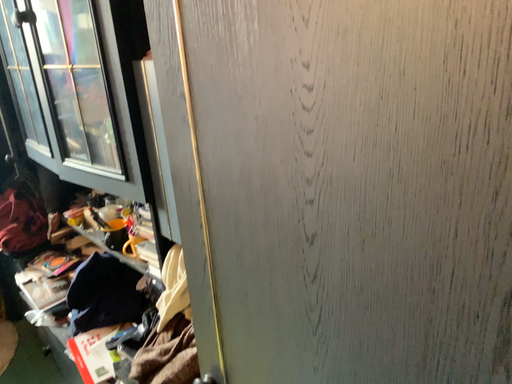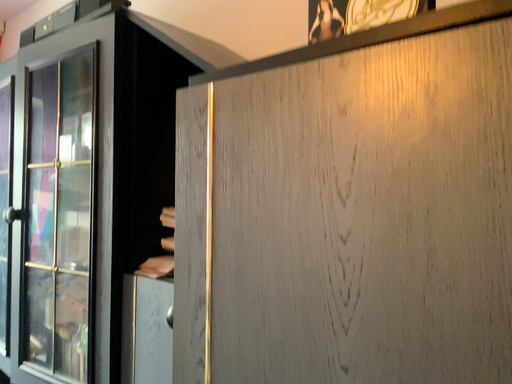
Question: How did the camera likely rotate when shooting the video?

Choices:
 (A) rotated downward
 (B) rotated upward

Answer: (B)